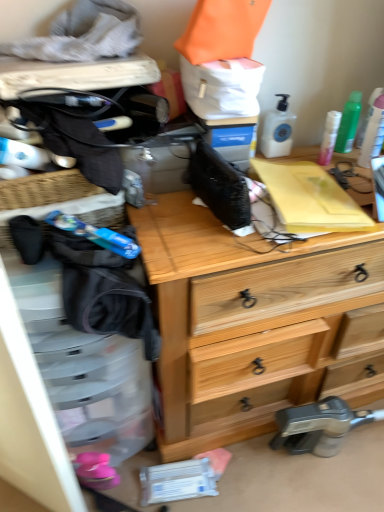
Image resolution: width=384 pixels, height=512 pixels. I want to click on vacant space situated on the left part of green plastic spray can at upper right, acting as the fourth toiletry starting from the left, so click(x=314, y=159).